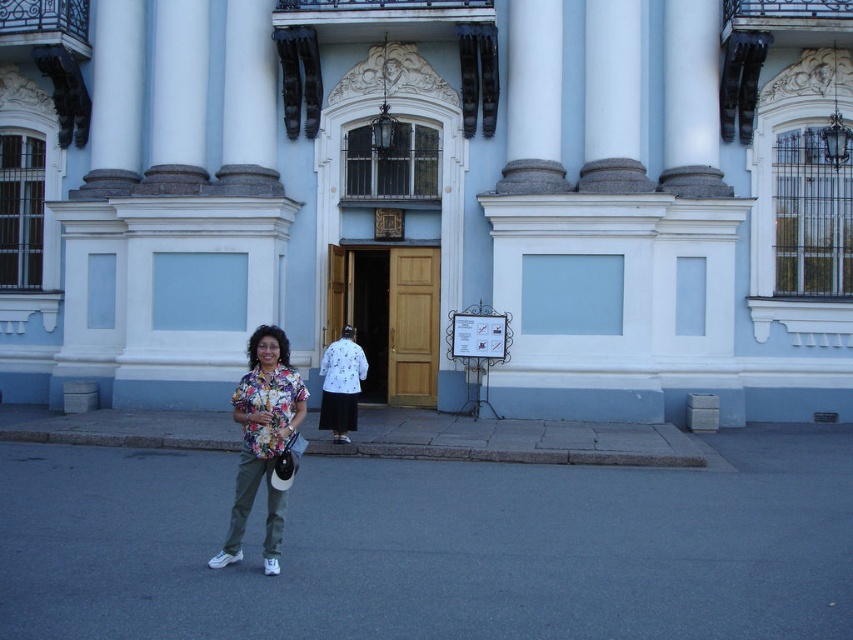
In the scene shown: You are a visitor approaching the grand classical building. You see the floral print shirt at center and the white marble column at upper left. Which object is closer to the entrance of the building?

The floral print shirt at center is closer to the entrance of the building because it is positioned to the right of the white marble column at upper left, which is further away from the entrance.

You are a visitor standing in front of the grand classical building. You notice the white marble column at upper left and the white dotted shirt at center. Which object is located to the left of the other?

The white marble column at upper left is positioned on the left side of white dotted shirt at center.